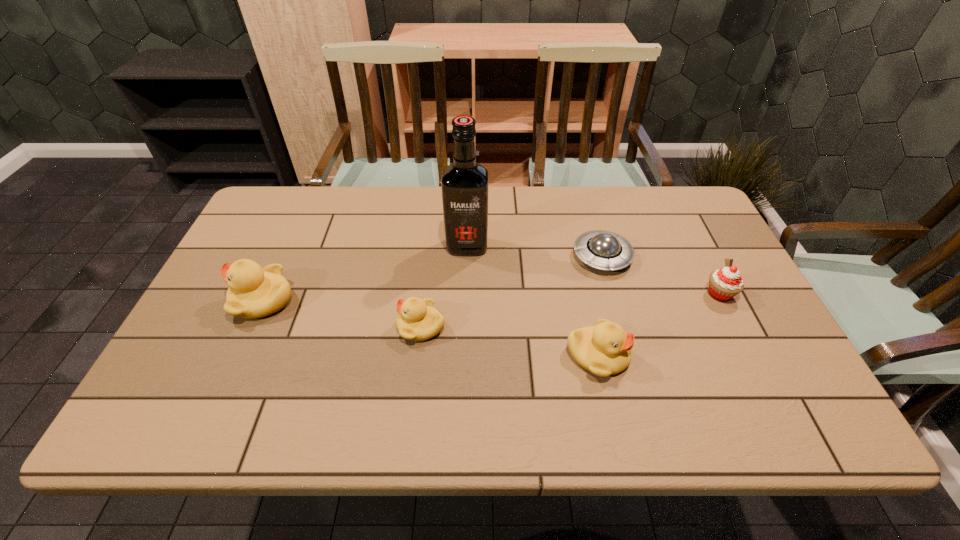
You are a GUI agent. You are given a task and a screenshot of the screen. Output one action in this format:
    pyautogui.click(x=<x>, y=<y>)
    Task: Click on the vacant point that satisfies the following two spatial constraints: 1. on the front-facing side of the tallest object; 2. on the right side of the shortest object
    
    Given the screenshot: What is the action you would take?
    pyautogui.click(x=467, y=256)

At what (x,y) coordinates should I click in order to perform the action: click on vacant space that satisfies the following two spatial constraints: 1. on the front-facing side of the cupcake; 2. on the left side of the tallest object. Please return your answer as a coordinate pair (x, y). Looking at the image, I should click on (466, 294).